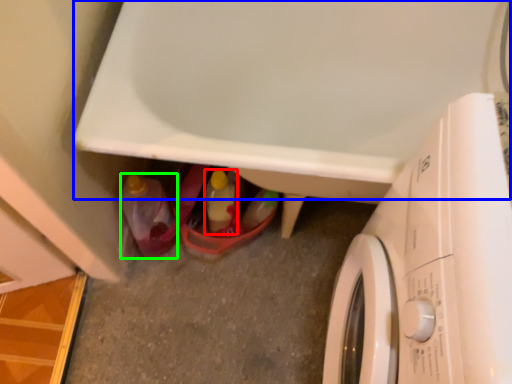
Question: Which object is positioned farthest from bottle (highlighted by a red box)? Select from bath (highlighted by a blue box) and bottle (highlighted by a green box).

Choices:
 (A) bath
 (B) bottle

Answer: (A)